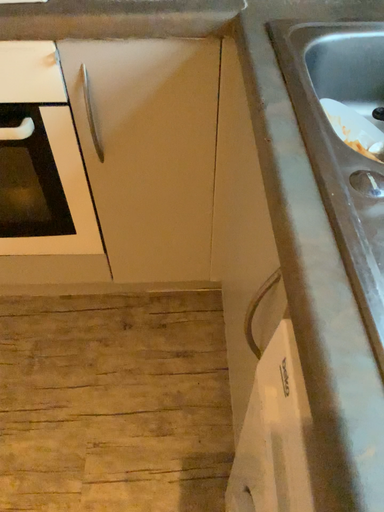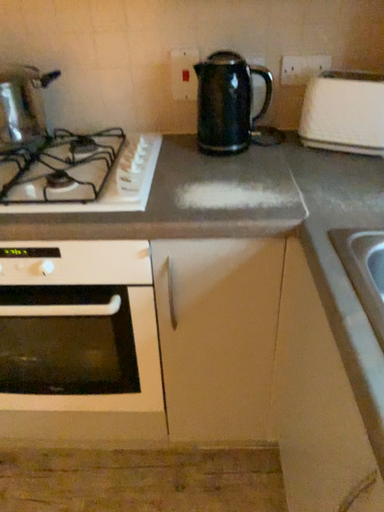
Question: How did the camera likely rotate when shooting the video?

Choices:
 (A) rotated downward
 (B) rotated upward

Answer: (B)